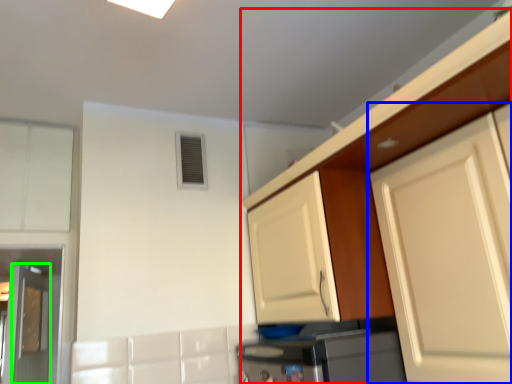
Question: Which object is positioned closest to cabinetry (highlighted by a red box)? Select from cabinetry (highlighted by a blue box) and door (highlighted by a green box).

Choices:
 (A) cabinetry
 (B) door

Answer: (A)